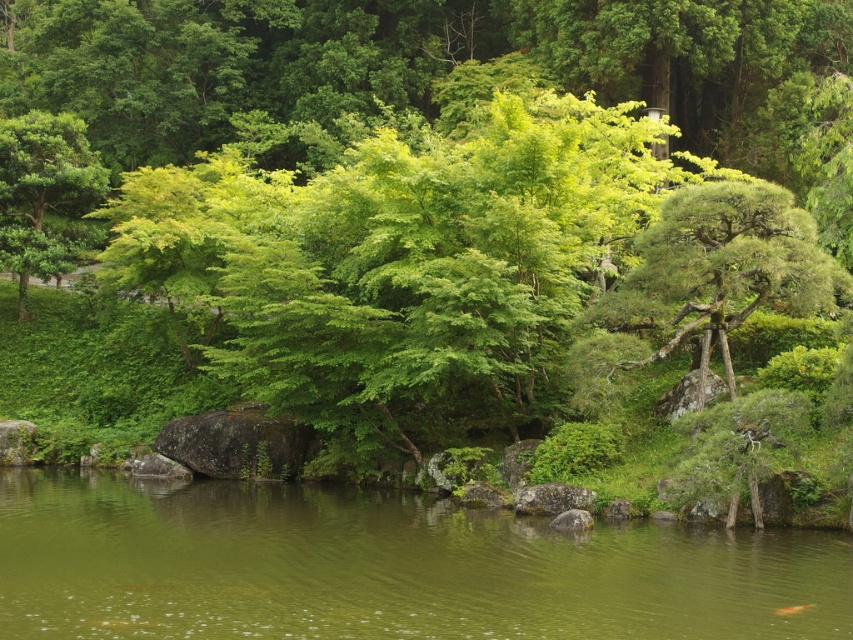
In the scene shown: Does green water at center appear under green leafy tree at left?

Correct, green water at center is located below green leafy tree at left.

Does point (42, 560) come in front of point (9, 157)?

That is True.

Identify the location of green water at center. The width and height of the screenshot is (853, 640). (386, 566).

Find the location of a particular element. The width and height of the screenshot is (853, 640). green water at center is located at coordinates (386, 566).